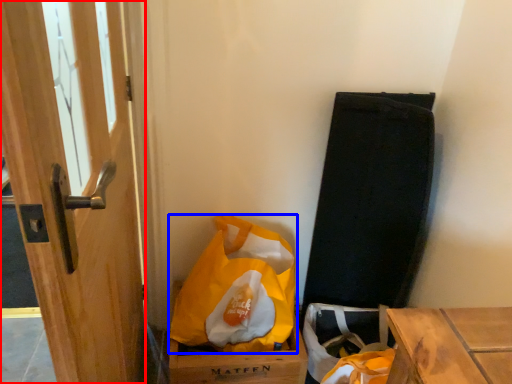
Question: Which of the following is the closest to the observer, door (highlighted by a red box) or plastic bag (highlighted by a blue box)?

Choices:
 (A) door
 (B) plastic bag

Answer: (A)